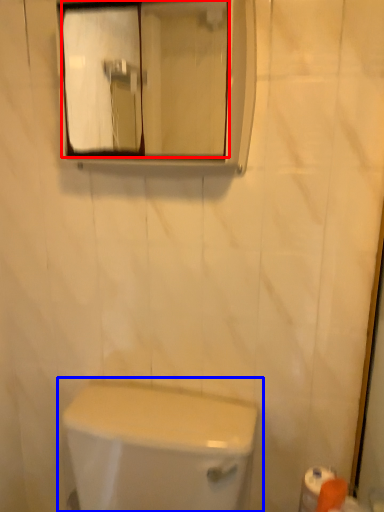
Question: Which object appears closest to the camera in this image, mirror (highlighted by a red box) or toilet (highlighted by a blue box)?

Choices:
 (A) mirror
 (B) toilet

Answer: (B)